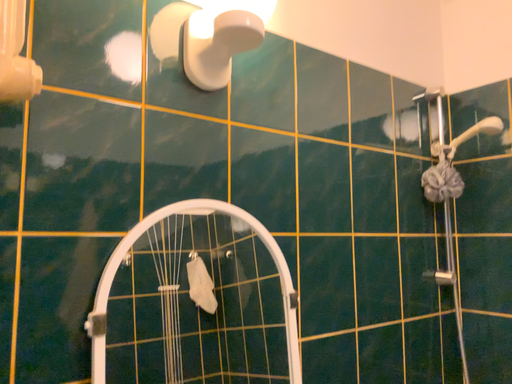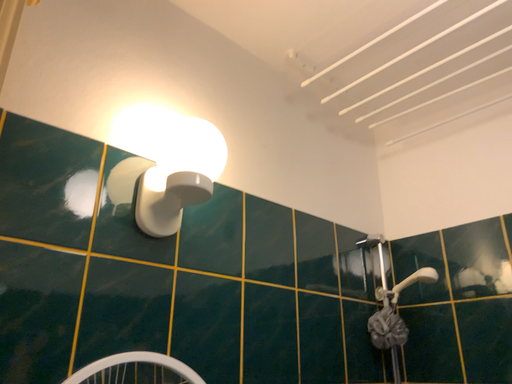
Question: How did the camera likely rotate when shooting the video?

Choices:
 (A) rotated upward
 (B) rotated downward

Answer: (A)